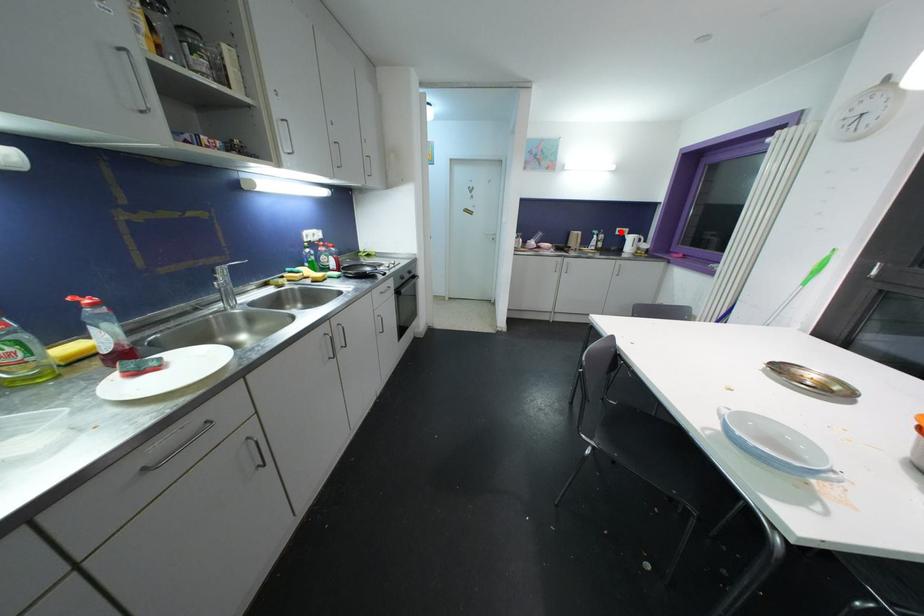
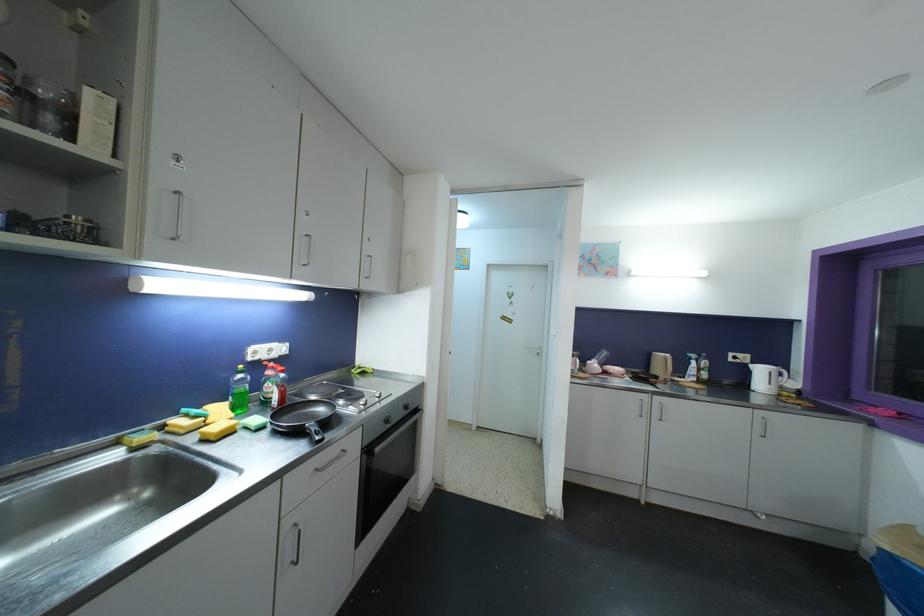
Question: I am providing you with two images of the same scene from different viewpoints. A red point is shown in image1. For the corresponding object point in image2, is it positioned nearer or farther from the camera?

Choices:
 (A) Nearer
 (B) Farther

Answer: (B)